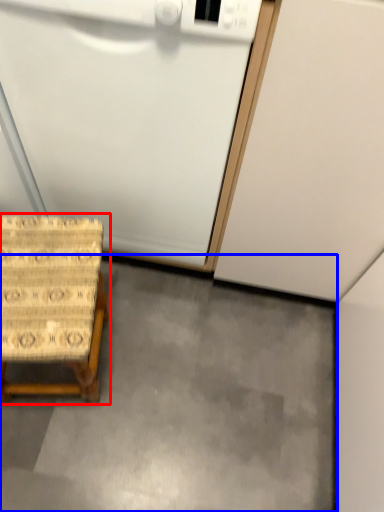
Question: Which of the following is the closest to the observer, furniture (highlighted by a red box) or concrete (highlighted by a blue box)?

Choices:
 (A) furniture
 (B) concrete

Answer: (A)